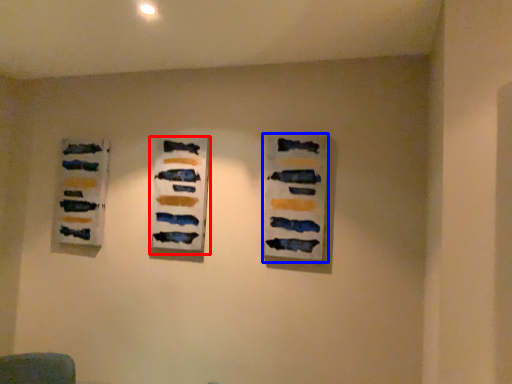
Question: Which object appears farthest to the camera in this image, art exhibition (highlighted by a red box) or art exhibition (highlighted by a blue box)?

Choices:
 (A) art exhibition
 (B) art exhibition

Answer: (A)